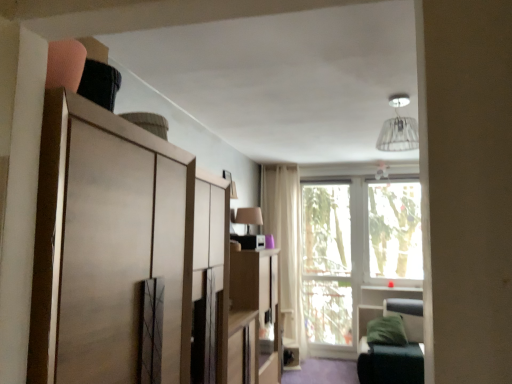
Question: Is matte beige lampshade at upper center to the left or to the right of transparent glass window at center, the first window screen in the left-to-right sequence, in the image?

Choices:
 (A) right
 (B) left

Answer: (B)

Question: Looking at the image, does matte beige lampshade at upper center seem bigger or smaller compared to transparent glass window at center, placed as the second window screen when sorted from right to left?

Choices:
 (A) small
 (B) big

Answer: (A)

Question: Which object is positioned farthest from the green leather bunk bed at lower right?

Choices:
 (A) matte wood cabinet at upper left, the first cabinetry positioned from the front
 (B) beige fabric curtain at center
 (C) matte beige lampshade at upper center
 (D) transparent glass window at center, placed as the second window screen when sorted from right to left
 (E) wooden cabinet at center, which is counted as the first cabinetry, starting from the back

Answer: (A)

Question: Estimate the real-world distances between objects in this image. Which object is farther from the wooden cabinet at center, positioned as the first cabinetry in right-to-left order?

Choices:
 (A) matte wood cabinet at upper left, the 2th cabinetry viewed from the back
 (B) white fabric lampshade at upper center
 (C) green leather bunk bed at lower right
 (D) beige fabric curtain at center
 (E) transparent glass window at center, the 1th window screen when ordered from right to left

Answer: (E)